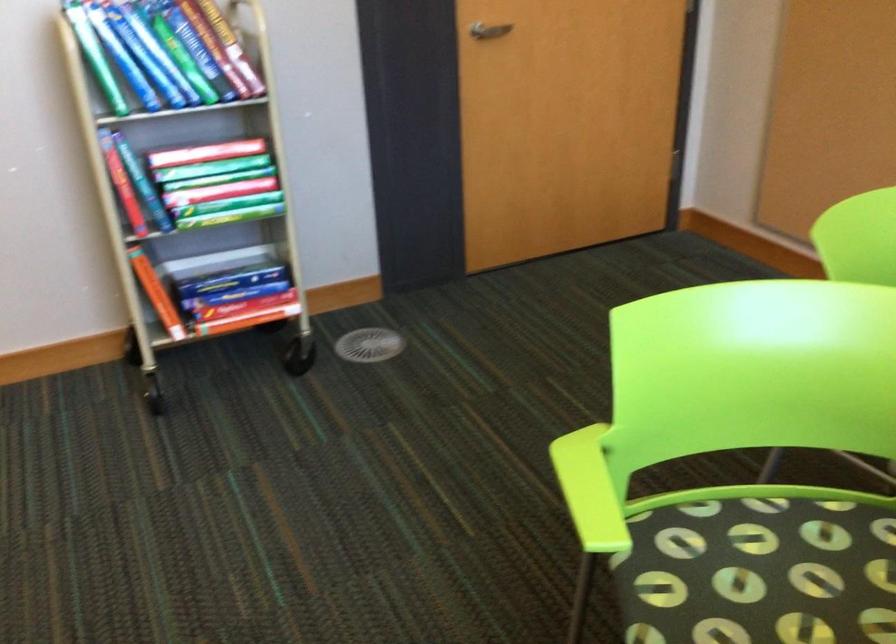
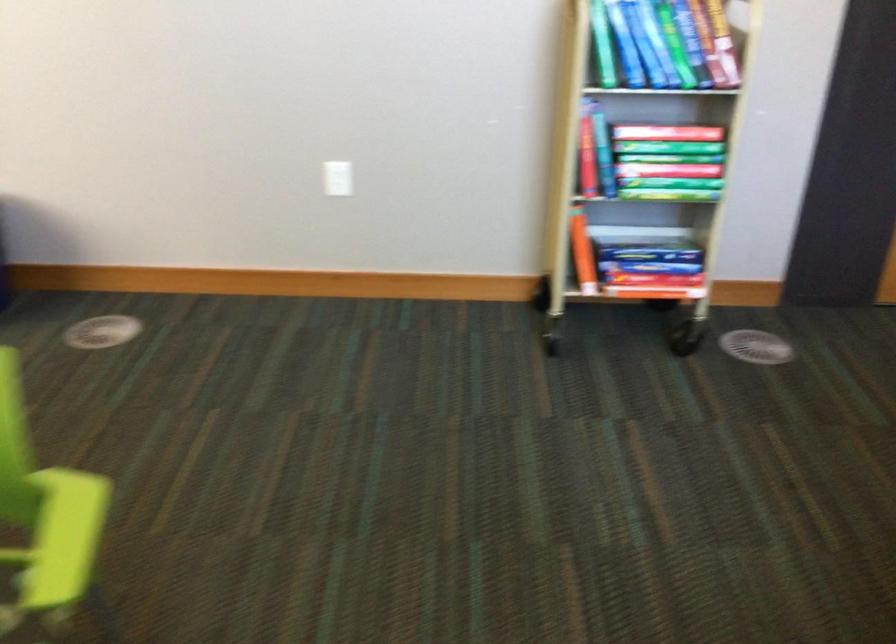
Looking at this image, which direction would the cameraman need to move to produce the second image?

The movement direction of the cameraman is left, backward.